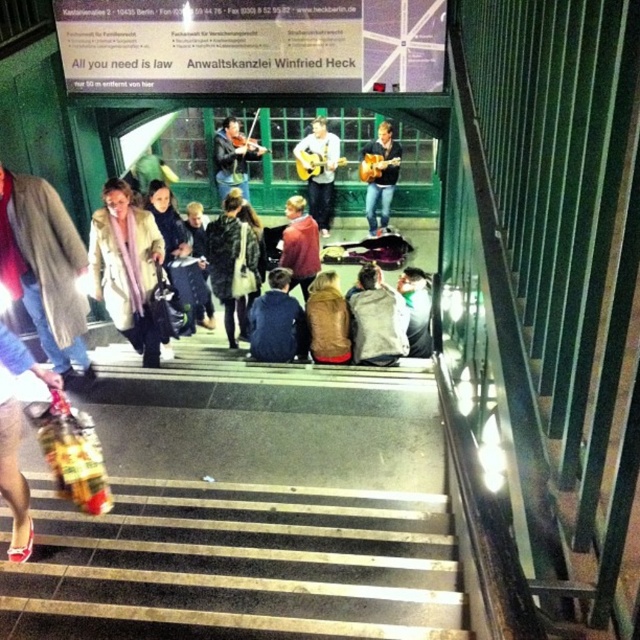
Question: Does matte red shoes at lower left appear under brown suede jacket at center?

Choices:
 (A) no
 (B) yes

Answer: (B)

Question: Which point is farther from the camera taking this photo?

Choices:
 (A) (12, 538)
 (B) (4, 268)

Answer: (B)

Question: Does light brown fur coat at left appear on the right side of light brown leather jacket at upper center?

Choices:
 (A) no
 (B) yes

Answer: (B)

Question: Can you confirm if black leather jacket at center is bigger than light gray fabric jacket at center?

Choices:
 (A) yes
 (B) no

Answer: (A)

Question: Among these points, which one is nearest to the camera?

Choices:
 (A) (141, 579)
 (B) (10, 435)

Answer: (A)

Question: Which of the following is the farthest from the observer?

Choices:
 (A) (241, 188)
 (B) (70, 296)

Answer: (A)